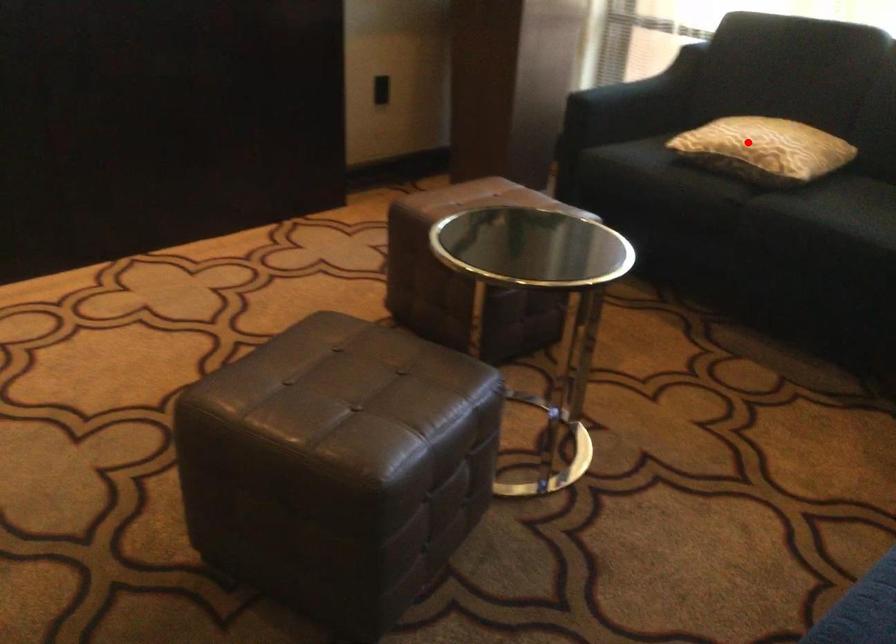
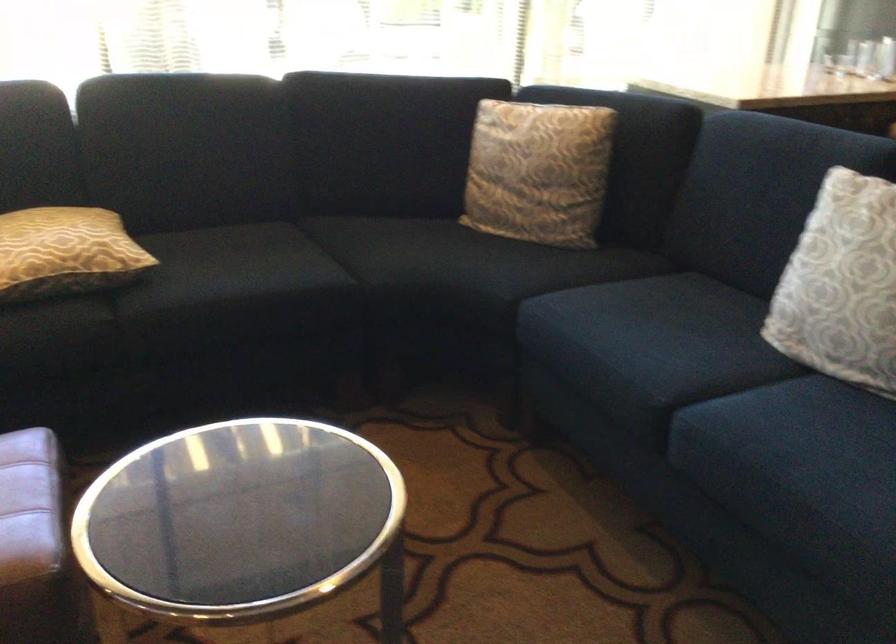
Question: A red point is marked in image1. In image2, is the corresponding 3D point closer to the camera or farther? Reply with the corresponding letter.

Choices:
 (A) The corresponding 3D point is closer.
 (B) The corresponding 3D point is farther.

Answer: (A)